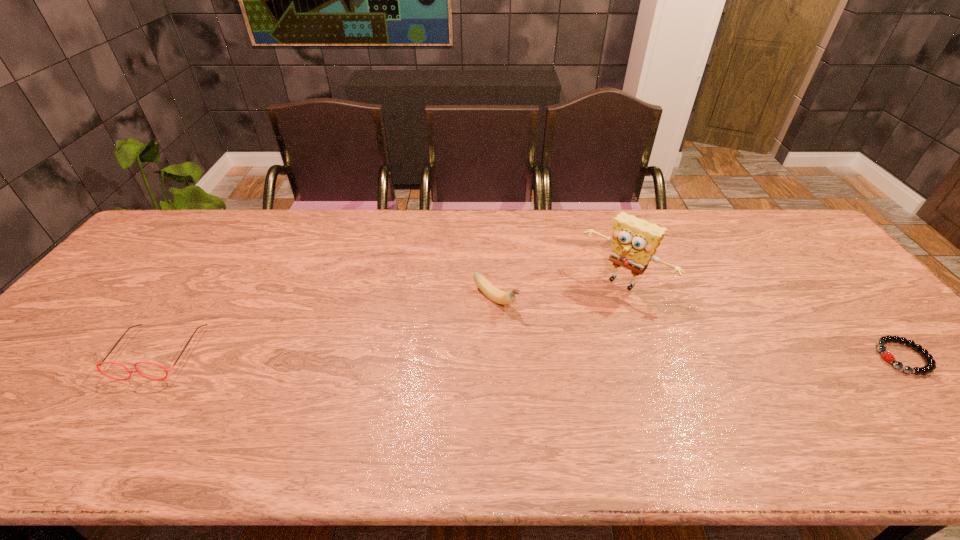
I want to click on free space between the spectacles and the banana, so click(x=327, y=326).

Select which object appears as the closest to the tallest object. Please provide its 2D coordinates. Your answer should be formatted as a tuple, i.e. [(x, y)], where the tuple contains the x and y coordinates of a point satisfying the conditions above.

[(498, 296)]

I want to click on object that is the closest to the shortest object, so click(634, 241).

This screenshot has width=960, height=540. What are the coordinates of `vacant space that satisfies the following two spatial constraints: 1. on the back side of the third shortest object; 2. on the right side of the sponge` in the screenshot? It's located at (495, 283).

The height and width of the screenshot is (540, 960). Identify the location of vacant space that satisfies the following two spatial constraints: 1. on the front-facing side of the leftmost object; 2. on the right side of the shortest object. (156, 357).

You are a GUI agent. You are given a task and a screenshot of the screen. Output one action in this format:
    pyautogui.click(x=<x>, y=<y>)
    Task: Click on the free space that satisfies the following two spatial constraints: 1. on the front-facing side of the bracelet; 2. on the right side of the third tallest object
    
    Given the screenshot: What is the action you would take?
    pyautogui.click(x=156, y=357)

What are the coordinates of `free region that satisfies the following two spatial constraints: 1. on the front side of the tallest object; 2. on the left side of the rightmost object` in the screenshot? It's located at point(649,357).